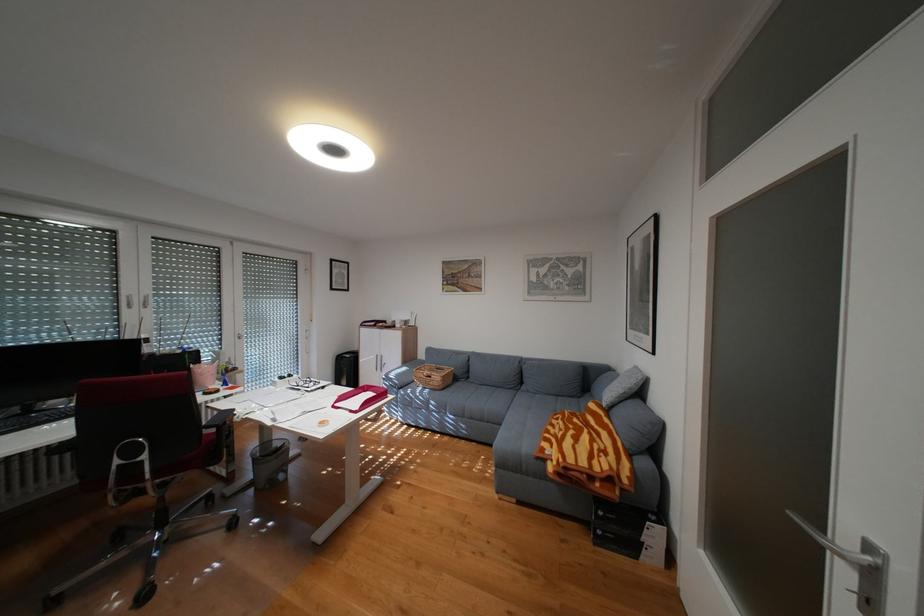
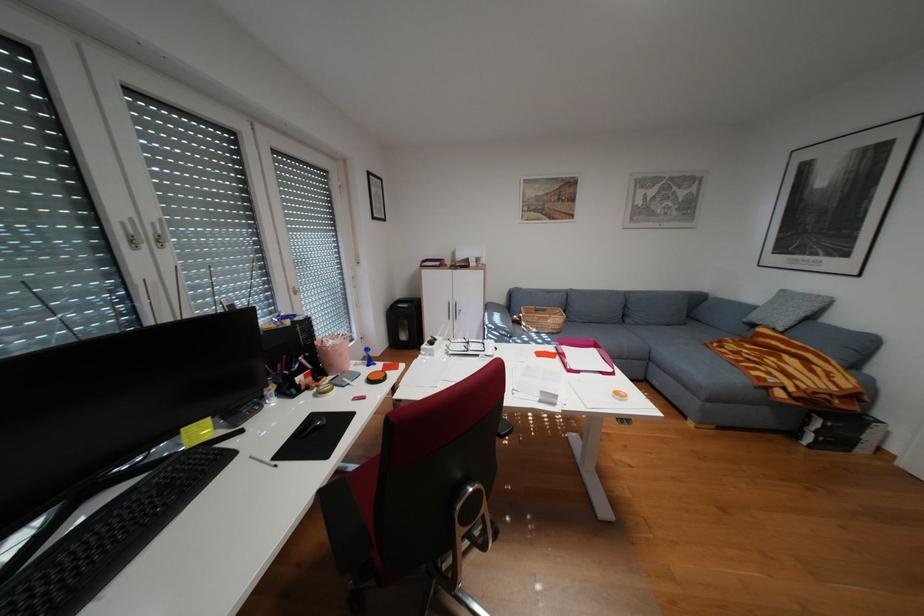
Find the pixel in the second image that matches the point at 393,323 in the first image.

(460, 262)